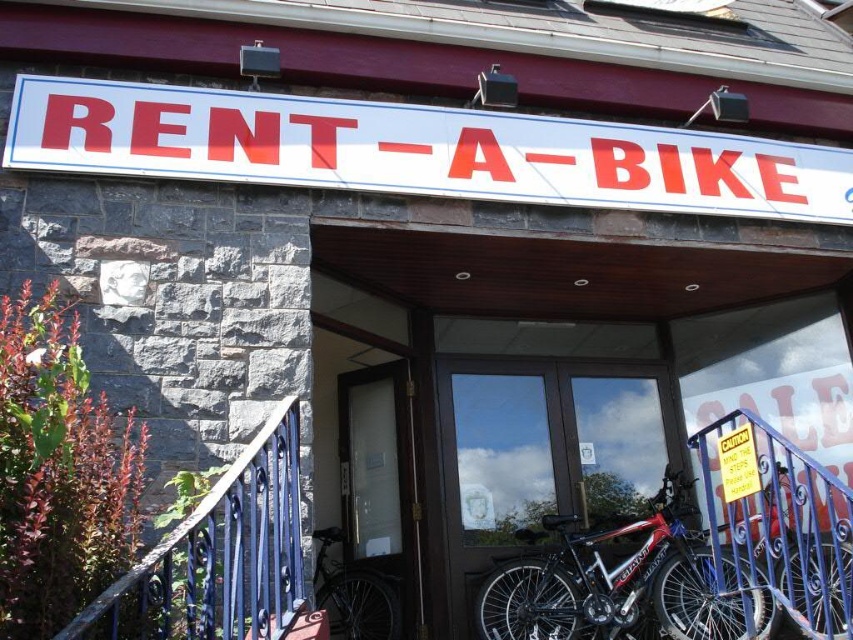
Is white plastic sign at upper center shorter than blue metal rail at lower right?

Yes.

Can you confirm if white plastic sign at upper center is positioned above blue metal rail at lower right?

Yes.

Where is `white plastic sign at upper center`? This screenshot has width=853, height=640. white plastic sign at upper center is located at coordinates (416, 150).

Who is positioned more to the right, shiny metallic bicycle at center or yellow paper caution sign at center?

yellow paper caution sign at center is more to the right.

Between shiny metallic bicycle at center and yellow paper caution sign at center, which one is positioned higher?

yellow paper caution sign at center

Does point (630, 554) come behind point (740, 483)?

Yes.

In order to click on shiny metallic bicycle at center in this screenshot , I will do tap(612, 582).

Between metallic silver bicycle at center and yellow paper caution sign at center, which one has more height?

metallic silver bicycle at center

Which is above, metallic silver bicycle at center or yellow paper caution sign at center?

yellow paper caution sign at center

Identify the location of metallic silver bicycle at center. The height and width of the screenshot is (640, 853). (538, 456).